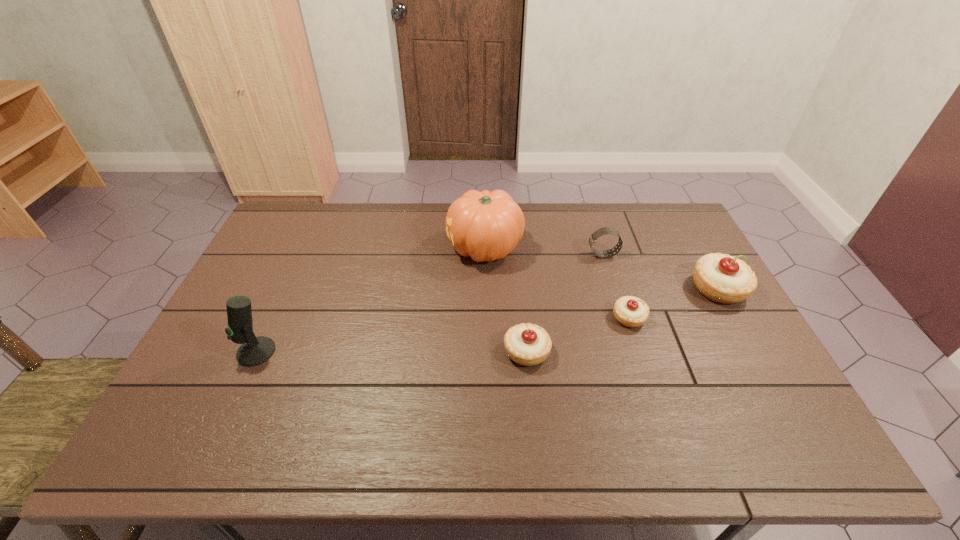
With all pastrys evenly spaced, where should an extra pastry be placed on the left to continue the pattern? Please point out a vacant space. Please provide its 2D coordinates. Your answer should be formatted as a tuple, i.e. [(x, y)], where the tuple contains the x and y coordinates of a point satisfying the conditions above.

[(408, 391)]